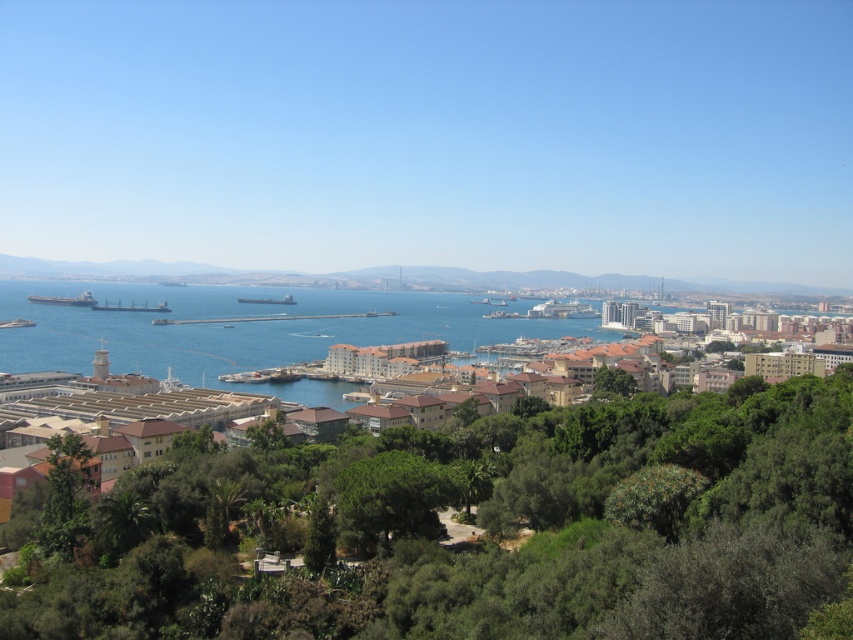
Can you confirm if green leafy tree at lower center is shorter than green leafy tree at lower left?

Correct, green leafy tree at lower center is not as tall as green leafy tree at lower left.

Is green leafy tree at lower center smaller than green leafy tree at lower left?

Yes, green leafy tree at lower center is smaller than green leafy tree at lower left.

Who is more distant from viewer, (410, 488) or (47, 524)?

The point (47, 524) is behind.

Identify the location of green leafy tree at lower center. (x=392, y=499).

Who is more forward, (235,346) or (442,500)?

Point (442,500) is more forward.

Does point (228, 340) lie in front of point (378, 474)?

No, it is not.

At what (x,y) coordinates should I click in order to perform the action: click on brown textured buildings at center. Please return your answer as a coordinate pair (x, y). Looking at the image, I should click on (241, 332).

You are a GUI agent. You are given a task and a screenshot of the screen. Output one action in this format:
    pyautogui.click(x=<x>, y=<y>)
    Task: Click on the blue water at center
    The width and height of the screenshot is (853, 640).
    Given the screenshot: What is the action you would take?
    pyautogui.click(x=247, y=326)

Does blue water at center appear under brown textured buildings at center?

Yes.

Does point (143, 291) come behind point (120, 321)?

Yes, it is.

At what (x,y) coordinates should I click in order to perform the action: click on blue water at center. Please return your answer as a coordinate pair (x, y). Looking at the image, I should click on (247, 326).